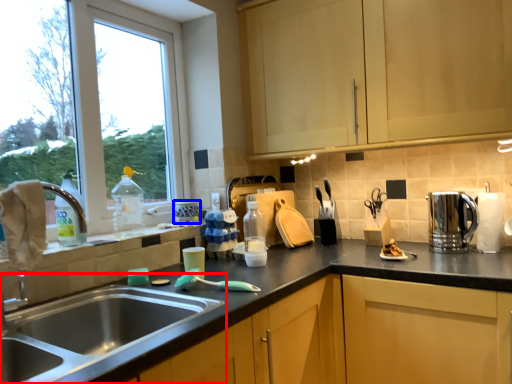
Question: Which point is closer to the camera, sink (highlighted by a red box) or appliance (highlighted by a blue box)?

Choices:
 (A) sink
 (B) appliance

Answer: (A)